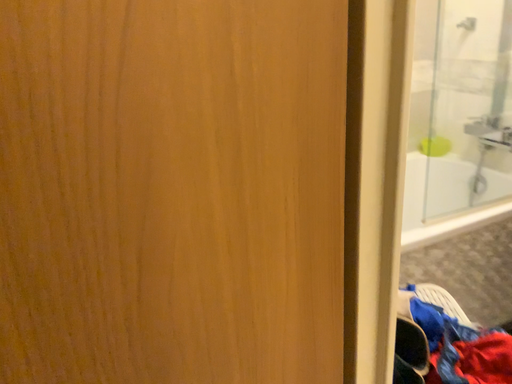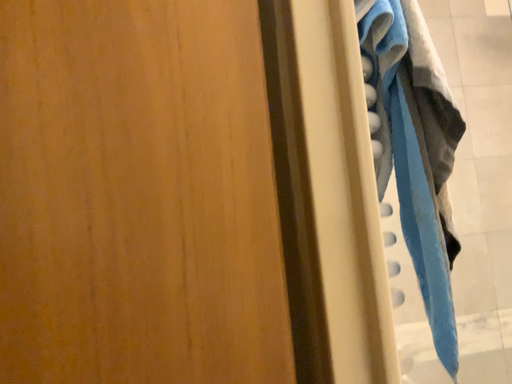
Question: How did the camera likely rotate when shooting the video?

Choices:
 (A) rotated left
 (B) rotated right

Answer: (A)